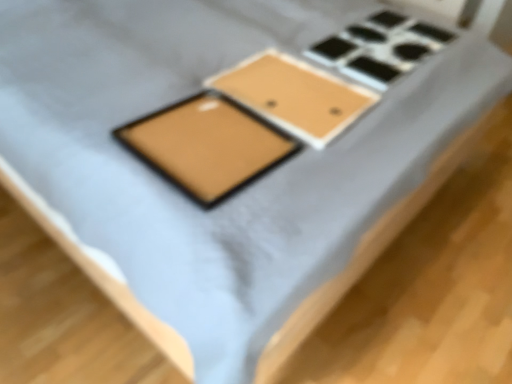
Question: From the image's perspective, is matte gold tablet at center below matte brown tray at center?

Choices:
 (A) no
 (B) yes

Answer: (B)

Question: Considering the relative sizes of matte gold tablet at center and matte brown tray at center in the image provided, is matte gold tablet at center bigger than matte brown tray at center?

Choices:
 (A) yes
 (B) no

Answer: (A)

Question: Is matte gold tablet at center facing towards matte brown tray at center?

Choices:
 (A) yes
 (B) no

Answer: (B)

Question: From a real-world perspective, is matte gold tablet at center physically below matte brown tray at center?

Choices:
 (A) no
 (B) yes

Answer: (A)

Question: Does matte gold tablet at center have a lesser width compared to matte brown tray at center?

Choices:
 (A) yes
 (B) no

Answer: (A)

Question: Is matte gold tablet at center not close to matte brown tray at center?

Choices:
 (A) yes
 (B) no

Answer: (B)

Question: Is matte brown tray at center smaller than matte gold tablet at center?

Choices:
 (A) yes
 (B) no

Answer: (A)

Question: Can we say matte brown tray at center lies outside matte gold tablet at center?

Choices:
 (A) no
 (B) yes

Answer: (B)

Question: Would you say matte brown tray at center is a long distance from matte gold tablet at center?

Choices:
 (A) no
 (B) yes

Answer: (A)

Question: From the image's perspective, does matte brown tray at center appear lower than matte gold tablet at center?

Choices:
 (A) no
 (B) yes

Answer: (A)

Question: Can you confirm if matte brown tray at center is wider than matte gold tablet at center?

Choices:
 (A) no
 (B) yes

Answer: (B)

Question: Is matte brown tray at center with matte gold tablet at center?

Choices:
 (A) no
 (B) yes

Answer: (A)

Question: Is matte brown tray at center taller or shorter than matte gold tablet at center?

Choices:
 (A) short
 (B) tall

Answer: (A)